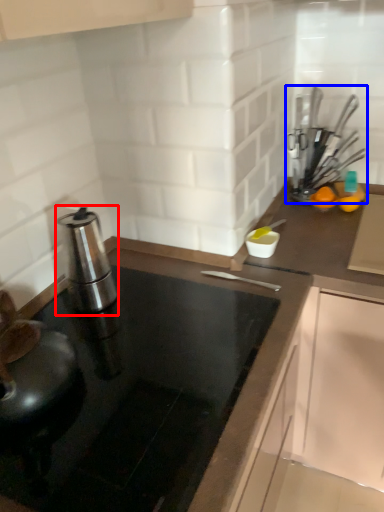
Question: Which point is closer to the camera, kitchen appliance (highlighted by a red box) or kitchen appliance (highlighted by a blue box)?

Choices:
 (A) kitchen appliance
 (B) kitchen appliance

Answer: (A)